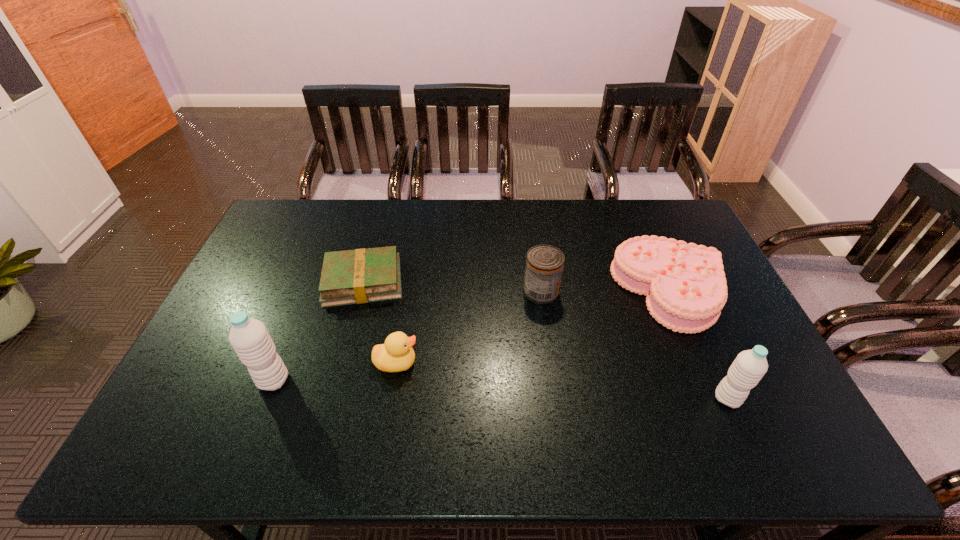
Identify the location of vacant space at the left edge of the desktop. point(276,264).

Find the location of a particular element. Image resolution: width=960 pixels, height=540 pixels. vacant space at the right edge of the desktop is located at coordinates (734, 305).

The height and width of the screenshot is (540, 960). Find the location of `blank space at the far right corner`. blank space at the far right corner is located at coordinates (649, 207).

Where is `vacant area that lies between the taller water bottle and the duckling`? This screenshot has height=540, width=960. vacant area that lies between the taller water bottle and the duckling is located at coordinates (335, 372).

Identify the location of empty space between the shortest object and the duckling. This screenshot has width=960, height=540. (379, 322).

Where is `empty space that is in between the shorter water bottle and the book`? This screenshot has width=960, height=540. empty space that is in between the shorter water bottle and the book is located at coordinates (545, 340).

At what (x,y) coordinates should I click in order to perform the action: click on vacant region between the right water bottle and the taller water bottle. Please return your answer as a coordinate pair (x, y). The height and width of the screenshot is (540, 960). Looking at the image, I should click on (500, 389).

Find the location of a particular element. vacant space that's between the taller water bottle and the right water bottle is located at coordinates (500, 389).

The height and width of the screenshot is (540, 960). I want to click on empty space that is in between the right water bottle and the shortest object, so click(545, 340).

Identify the location of free area in between the can and the left water bottle. (407, 336).